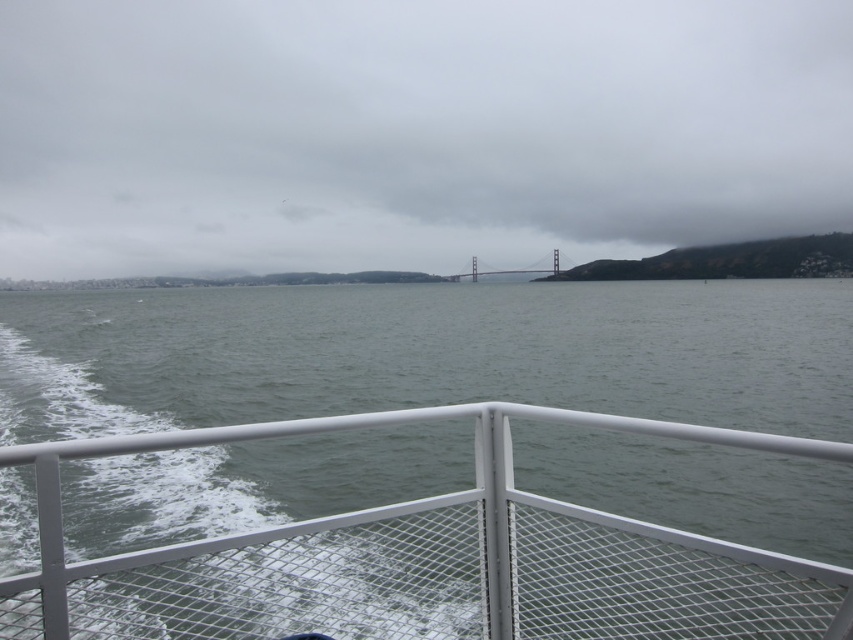
Is gray water at center to the left of painted steel bridge at center from the viewer's perspective?

Yes, gray water at center is to the left of painted steel bridge at center.

Between gray water at center and painted steel bridge at center, which one has less height?

Standing shorter between the two is gray water at center.

Does point (769, 332) lie behind point (502, 273)?

No, it is in front of (502, 273).

Find the location of a particular element. Image resolution: width=853 pixels, height=640 pixels. gray water at center is located at coordinates pos(436,531).

Who is more forward, (221, 529) or (53, 3)?

Point (221, 529) is in front.

Between gray water at center and transparent water at center, which one is positioned higher?

transparent water at center

Measure the distance between point (744, 548) and camera.

Point (744, 548) is 7.75 feet from camera.

Identify the location of gray water at center. (436, 531).

Between transparent water at center and painted steel bridge at center, which one appears on the right side from the viewer's perspective?

From the viewer's perspective, painted steel bridge at center appears more on the right side.

Does point (442, 81) come closer to viewer compared to point (546, 269)?

No, it is not.

At what (x,y) coordinates should I click in order to perform the action: click on transparent water at center. Please return your answer as a coordinate pair (x, y). The width and height of the screenshot is (853, 640). Looking at the image, I should click on (412, 132).